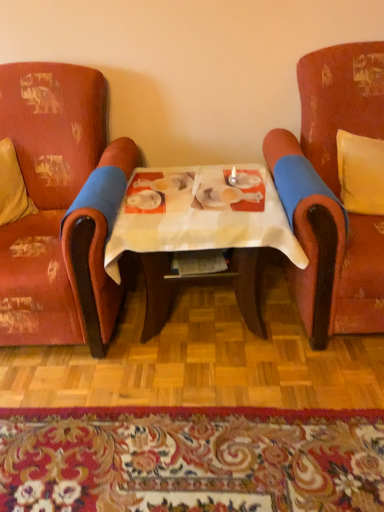
Question: Considering the positions of distressed red fabric armchair at left, positioned as the first chair in left-to-right order, and beige fabric pillow at left, placed as the 2th pillow when sorted from right to left, in the image, is distressed red fabric armchair at left, positioned as the first chair in left-to-right order, bigger or smaller than beige fabric pillow at left, placed as the 2th pillow when sorted from right to left,?

Choices:
 (A) big
 (B) small

Answer: (A)

Question: In terms of height, does distressed red fabric armchair at left, the second chair in the right-to-left sequence, look taller or shorter compared to beige fabric pillow at left, placed as the 2th pillow when sorted from right to left?

Choices:
 (A) short
 (B) tall

Answer: (B)

Question: Which of these objects is positioned farthest from the beige fabric pillow at left, placed as the 2th pillow when sorted from right to left?

Choices:
 (A) white paper table at center
 (B) velvet-like red armchair at right, which is counted as the second chair, starting from the left
 (C) yellow fabric pillow at right, which is the second pillow in left-to-right order
 (D) floral carpet at lower center
 (E) distressed red fabric armchair at left, the second chair in the right-to-left sequence

Answer: (C)

Question: Which is nearer to the beige fabric pillow at left, placed as the 2th pillow when sorted from right to left?

Choices:
 (A) floral carpet at lower center
 (B) velvet-like red armchair at right, which is counted as the second chair, starting from the left
 (C) white paper table at center
 (D) yellow fabric pillow at right, which is the second pillow in left-to-right order
 (E) distressed red fabric armchair at left, the second chair in the right-to-left sequence

Answer: (E)